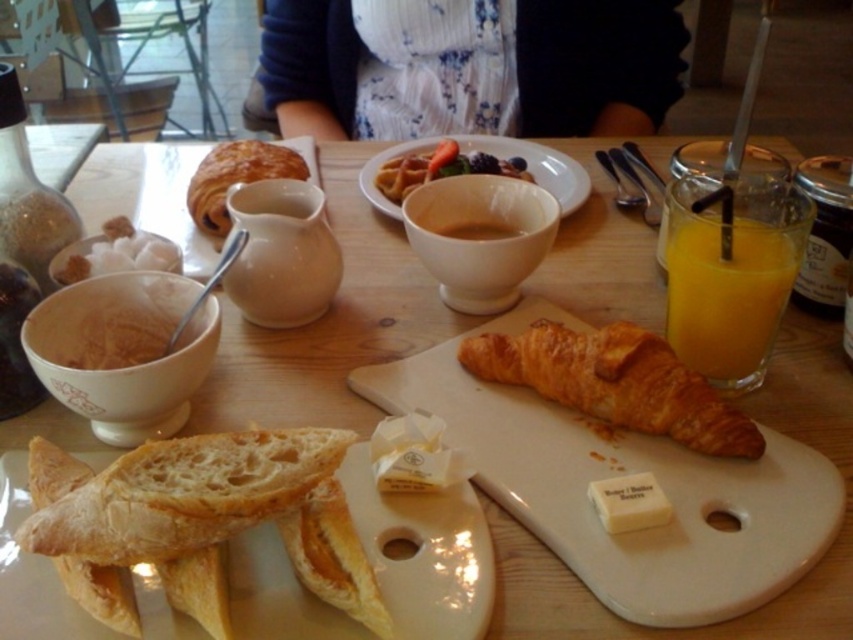
You are a customer at the breakfast table and want to spread butter on your croissant. Which item should you pick up first, the golden brown croissant at upper left or the white soft butter at center?

You should pick up the white soft butter at center first because the golden brown croissant at upper left is taller than the white soft butter at center, so the butter is lower and easier to reach.

From the picture: You are a customer at the breakfast table and want to reach the croissant on the serving board. The croissant you want is located at point (515,483). You have a 12 inch long fork. Can you reach it with your fork?

The distance between you and the croissant at point (515,483) is 16.05 inches. Since your fork is only 12 inches long, you cannot reach it with your current fork.

You are a customer at this breakfast table. You want to choose the item that is bigger between the golden brown bread at center and the translucent glass cup at right. Which one should you pick?

The golden brown bread at center is larger in size than the translucent glass cup at right, so you should pick the golden brown bread at center.